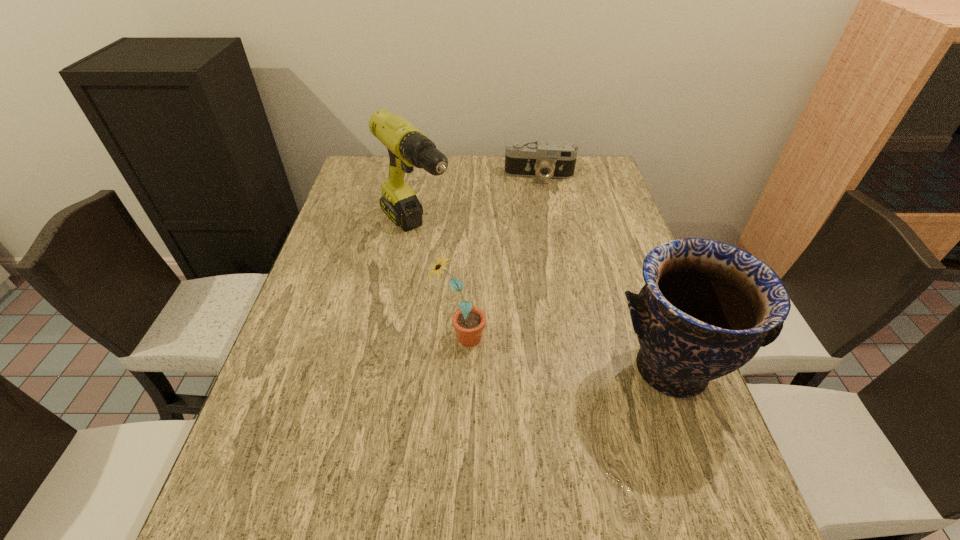
Identify the location of blank space at the near edge. (348, 483).

Image resolution: width=960 pixels, height=540 pixels. Find the location of `free space at the left edge of the desktop`. free space at the left edge of the desktop is located at coordinates (335, 416).

At what (x,y) coordinates should I click in order to perform the action: click on vacant space at the right edge of the desktop. Please return your answer as a coordinate pair (x, y). The image size is (960, 540). Looking at the image, I should click on (628, 248).

The width and height of the screenshot is (960, 540). Identify the location of vacant space at the far left corner. (388, 164).

Image resolution: width=960 pixels, height=540 pixels. In order to click on vacant region at the far right corner of the desktop in this screenshot , I will do `click(594, 170)`.

Where is `unoccupied position between the pottery and the farthest object`? The width and height of the screenshot is (960, 540). unoccupied position between the pottery and the farthest object is located at coordinates (605, 273).

At what (x,y) coordinates should I click in order to perform the action: click on vacant area between the pottery and the drill. Please return your answer as a coordinate pair (x, y). The width and height of the screenshot is (960, 540). Looking at the image, I should click on (542, 301).

The width and height of the screenshot is (960, 540). I want to click on free space that is in between the sunflower and the third nearest object, so click(438, 285).

Locate an element on the screen. The image size is (960, 540). unoccupied position between the drill and the shortest object is located at coordinates (477, 204).

At what (x,y) coordinates should I click in order to perform the action: click on vacant space that is in between the sunflower and the farthest object. Please return your answer as a coordinate pair (x, y). This screenshot has height=540, width=960. Looking at the image, I should click on (500, 256).